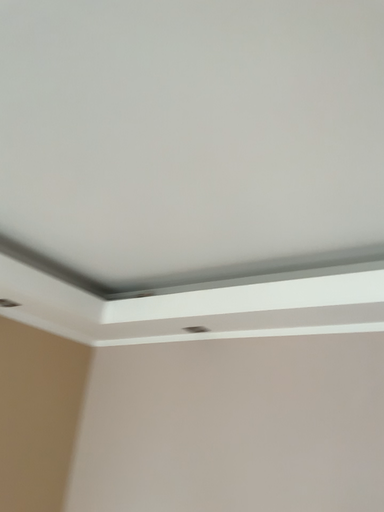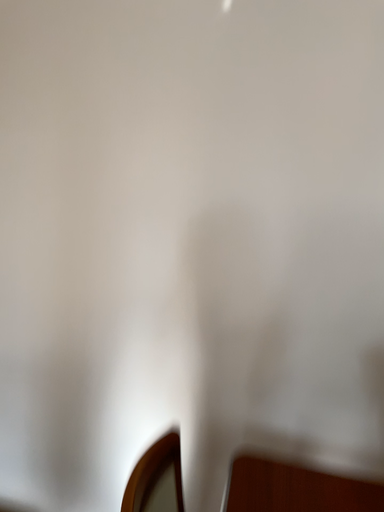
Question: How did the camera likely rotate when shooting the video?

Choices:
 (A) rotated left
 (B) rotated right

Answer: (B)